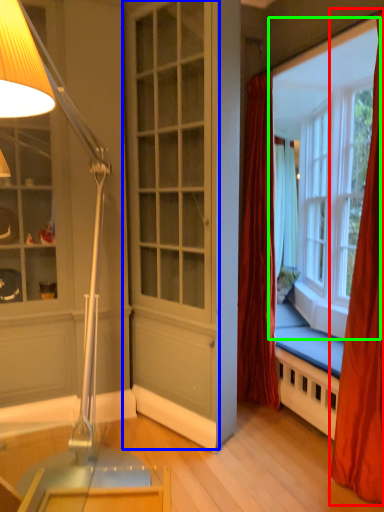
Question: Estimate the real-world distances between objects in this image. Which object is farther from curtain (highlighted by a red box), screen door (highlighted by a blue box) or window (highlighted by a green box)?

Choices:
 (A) screen door
 (B) window

Answer: (B)